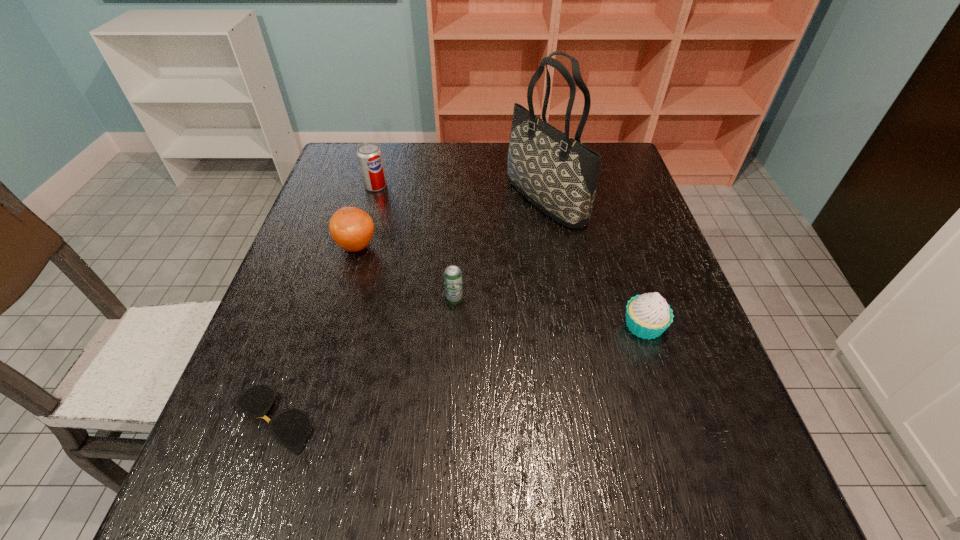
Where is `tote bag`? tote bag is located at coordinates (557, 174).

Locate an element on the screen. This screenshot has width=960, height=540. the tallest object is located at coordinates (557, 174).

I want to click on soda, so click(x=369, y=154).

In order to click on the fourth nearest object in this screenshot , I will do `click(351, 228)`.

Identify the location of the second nearest object. The height and width of the screenshot is (540, 960). (648, 315).

Locate an element on the screen. cupcake is located at coordinates (648, 315).

Image resolution: width=960 pixels, height=540 pixels. What are the coordinates of `beer can` in the screenshot? It's located at (452, 275).

This screenshot has height=540, width=960. I want to click on the fourth farthest object, so click(x=452, y=275).

Identify the location of spectacles. This screenshot has height=540, width=960. (291, 428).

You are a GUI agent. You are given a task and a screenshot of the screen. Output one action in this format:
    pyautogui.click(x=<x>, y=<y>)
    Task: Click on the shortest object
    This screenshot has height=540, width=960.
    Given the screenshot: What is the action you would take?
    pyautogui.click(x=291, y=428)